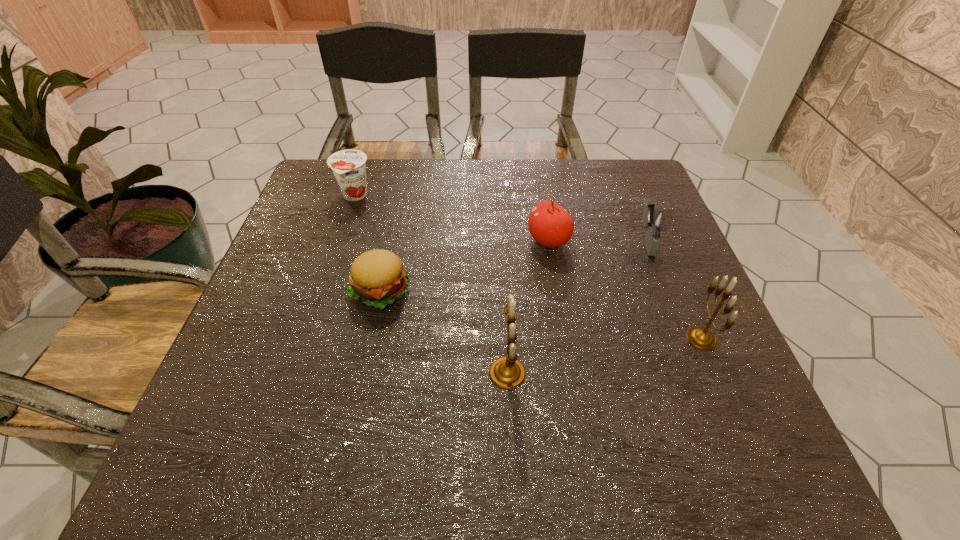
Find the location of a particular element. igniter situated at the right edge is located at coordinates (654, 221).

The image size is (960, 540). In order to click on object that is at the far left corner in this screenshot , I will do `click(349, 168)`.

Where is `vacant space at the far edge`? The image size is (960, 540). vacant space at the far edge is located at coordinates (549, 188).

Identify the location of vacant space at the near edge of the desktop. The height and width of the screenshot is (540, 960). (353, 394).

Identify the location of vacant space at the left edge of the desktop. The width and height of the screenshot is (960, 540). (278, 251).

In the image, there is a desktop. At what (x,y) coordinates should I click in order to perform the action: click on vacant space at the right edge. Please return your answer as a coordinate pair (x, y). This screenshot has width=960, height=540. Looking at the image, I should click on coord(657,261).

In the image, there is a desktop. Identify the location of vacant area at the near left corner. (241, 394).

Identify the location of vacant space at the far right corner of the desktop. (629, 197).

Where is `vacant position at the near right corner of the desktop`? This screenshot has height=540, width=960. vacant position at the near right corner of the desktop is located at coordinates (675, 383).

The image size is (960, 540). Identify the location of free space between the second tallest object and the apple. (625, 289).